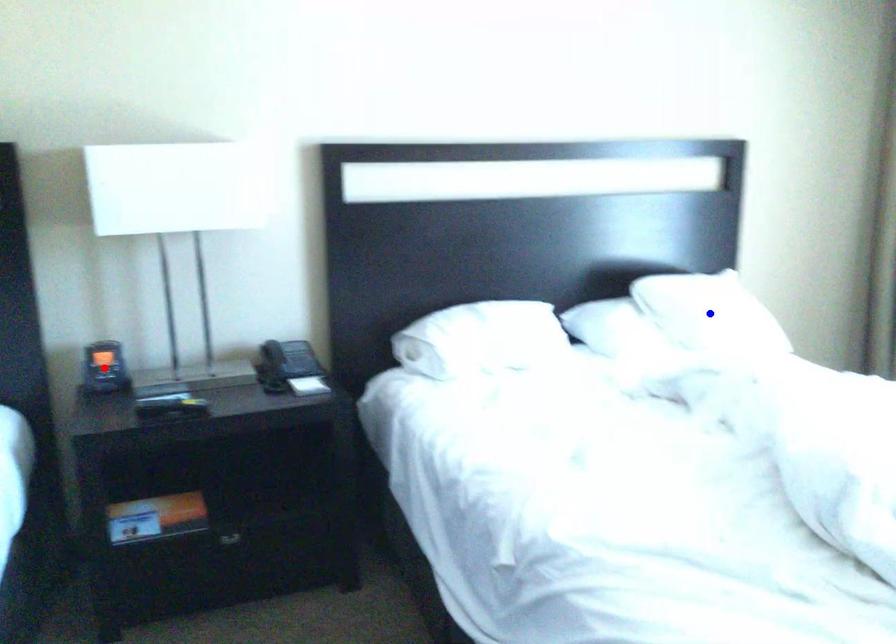
Question: Which of the two points in the image is closer to the camera?

Choices:
 (A) Blue point is closer.
 (B) Red point is closer.

Answer: (B)